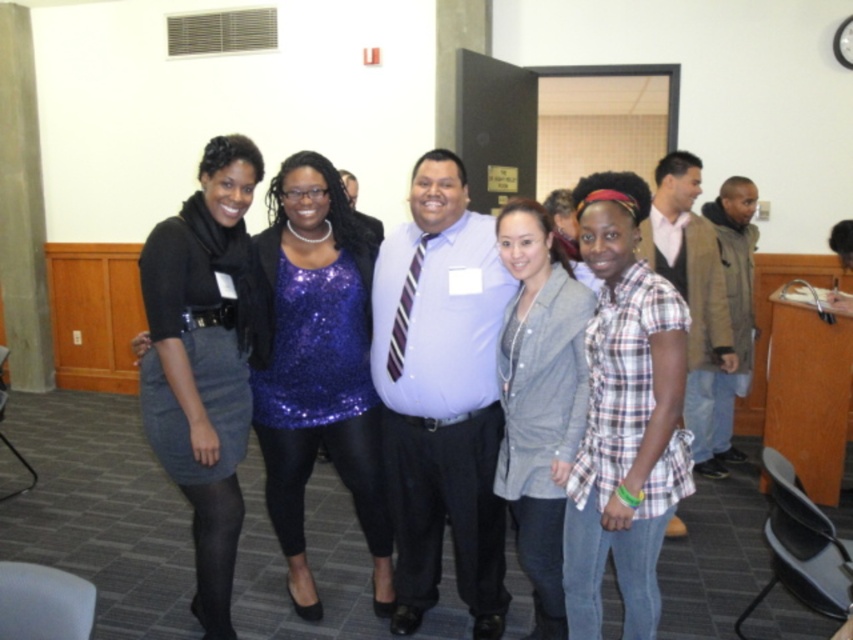
Question: Which object appears farthest from the camera in this image?

Choices:
 (A) sparkly blue top at center
 (B) plaid cotton shirt at center
 (C) denim jacket at center
 (D) brown fuzzy jacket at right

Answer: (D)

Question: Is matte blue shirt at center in front of sparkly blue top at center?

Choices:
 (A) yes
 (B) no

Answer: (A)

Question: Which of these objects is positioned farthest from the sparkly blue top at center?

Choices:
 (A) denim jacket at center
 (B) matte blue shirt at center
 (C) brown fuzzy jacket at right
 (D) denim skirt at center

Answer: (C)

Question: Which point appears farthest from the camera in this image?

Choices:
 (A) (521, 275)
 (B) (732, 305)

Answer: (B)

Question: Can you confirm if sparkly blue top at center is wider than brown fuzzy jacket at right?

Choices:
 (A) yes
 (B) no

Answer: (A)

Question: Is denim skirt at center below brown fuzzy jacket at right?

Choices:
 (A) yes
 (B) no

Answer: (A)